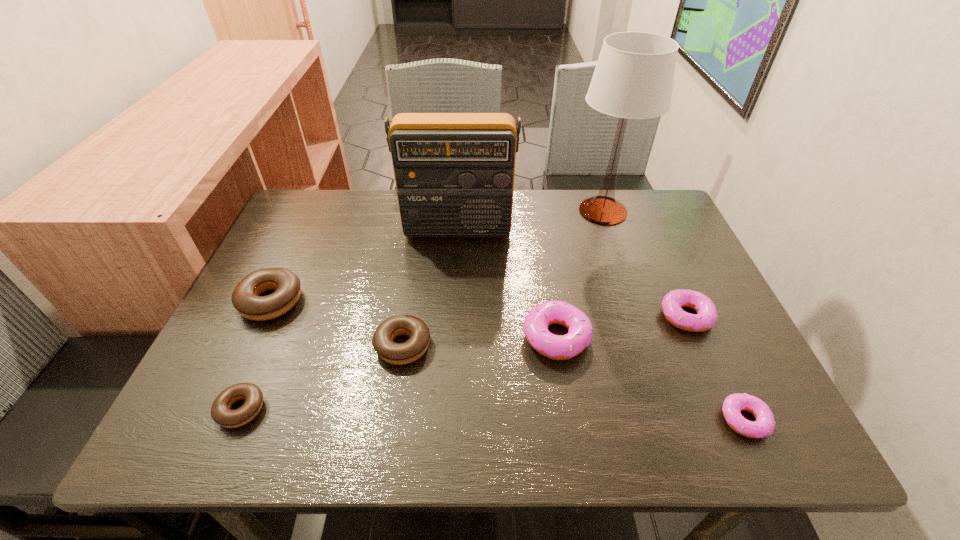
Find the location of a particular element. Image resolution: width=960 pixels, height=540 pixels. free spot at the far left corner of the desktop is located at coordinates (342, 194).

Where is `vacant space at the near left corner`? vacant space at the near left corner is located at coordinates (241, 429).

Find the location of a particular element. free space at the far right corner is located at coordinates (630, 235).

The width and height of the screenshot is (960, 540). Find the location of `vacant space at the near right corner of the desktop`. vacant space at the near right corner of the desktop is located at coordinates (773, 443).

Image resolution: width=960 pixels, height=540 pixels. I want to click on vacant area that lies between the fourth doughnut from left to right and the table lamp, so click(x=580, y=274).

Where is `vacant space that's between the second smallest pink doughnut and the nearest pink doughnut`? vacant space that's between the second smallest pink doughnut and the nearest pink doughnut is located at coordinates (715, 368).

This screenshot has height=540, width=960. Identify the location of free space that is in between the seventh shortest object and the second biggest brown doughnut. (430, 287).

You are a GUI agent. You are given a task and a screenshot of the screen. Output one action in this format:
    pyautogui.click(x=<x>, y=<y>)
    Task: Click on the free spot between the second smallest brown doughnut and the seventh shortest object
    Image resolution: width=960 pixels, height=540 pixels.
    Given the screenshot: What is the action you would take?
    pyautogui.click(x=430, y=287)

This screenshot has width=960, height=540. I want to click on vacant region between the radio receiver and the table lamp, so click(x=530, y=220).

I want to click on vacant area that lies between the second smallest pink doughnut and the nearest brown doughnut, so click(464, 363).